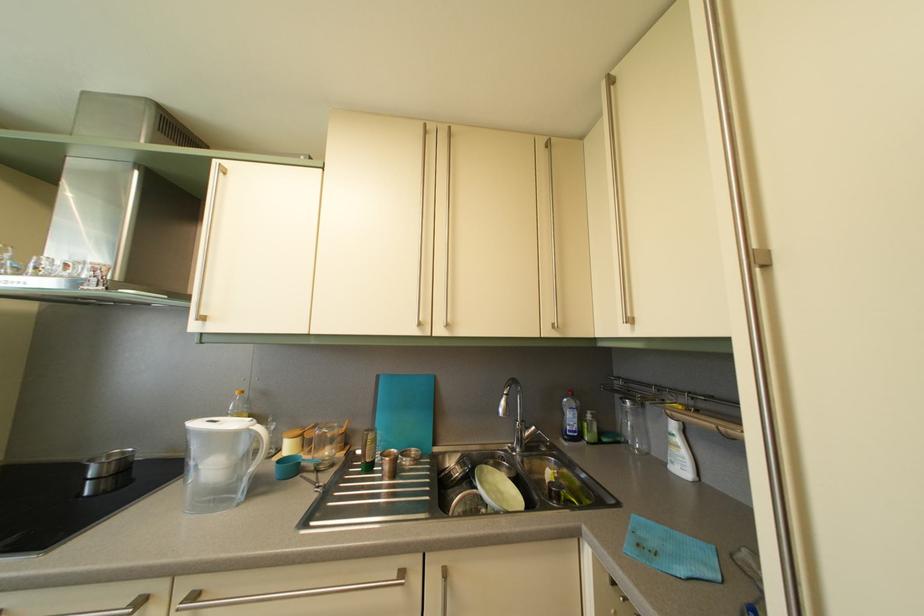
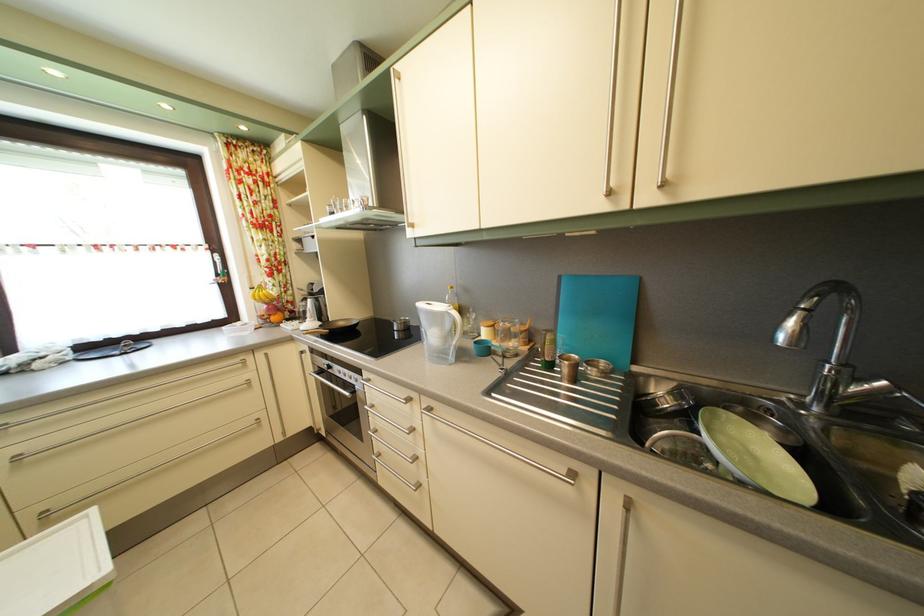
The point at (448, 583) is marked in the first image. Where is the corresponding point in the second image?

(629, 509)